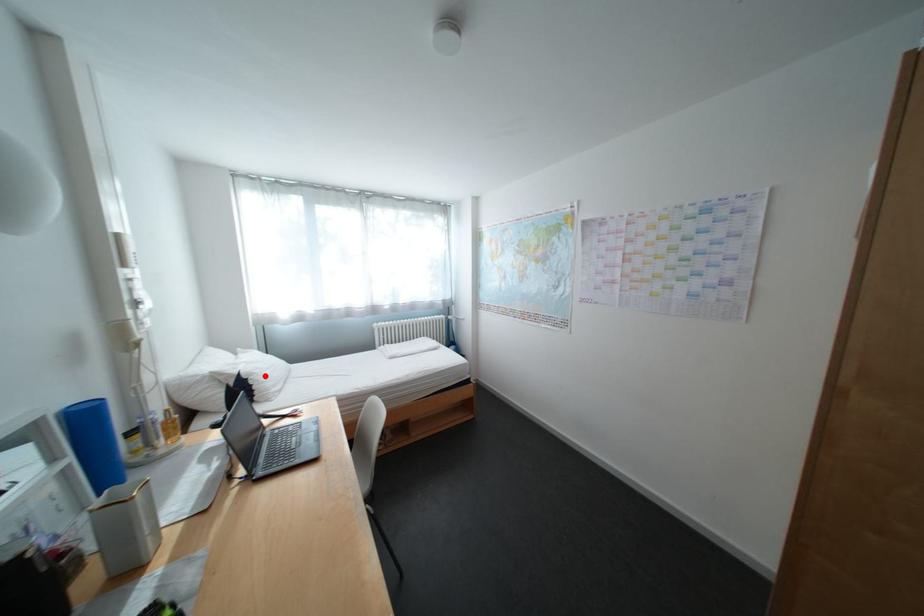
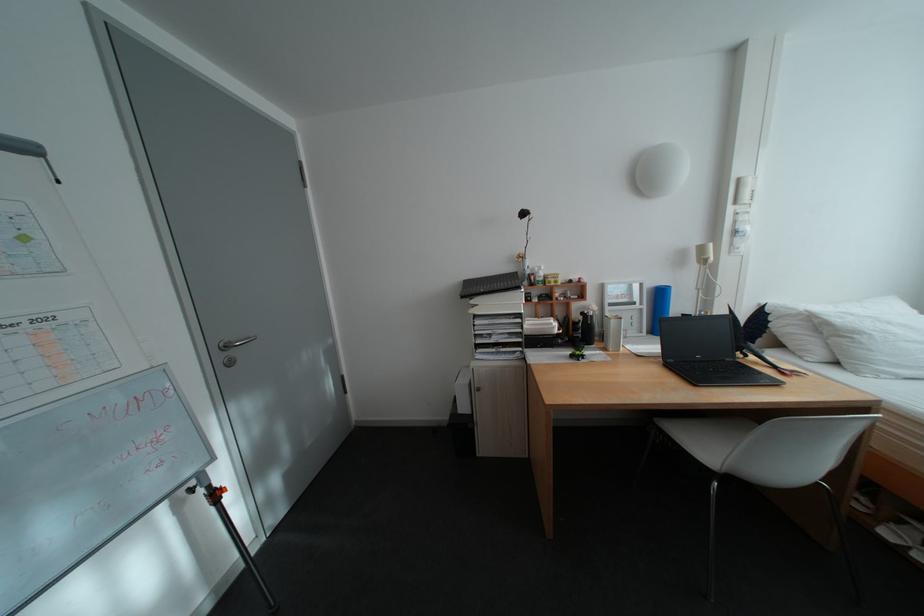
In the second image, find the point that corresponds to the highlighted location in the first image.

(871, 334)